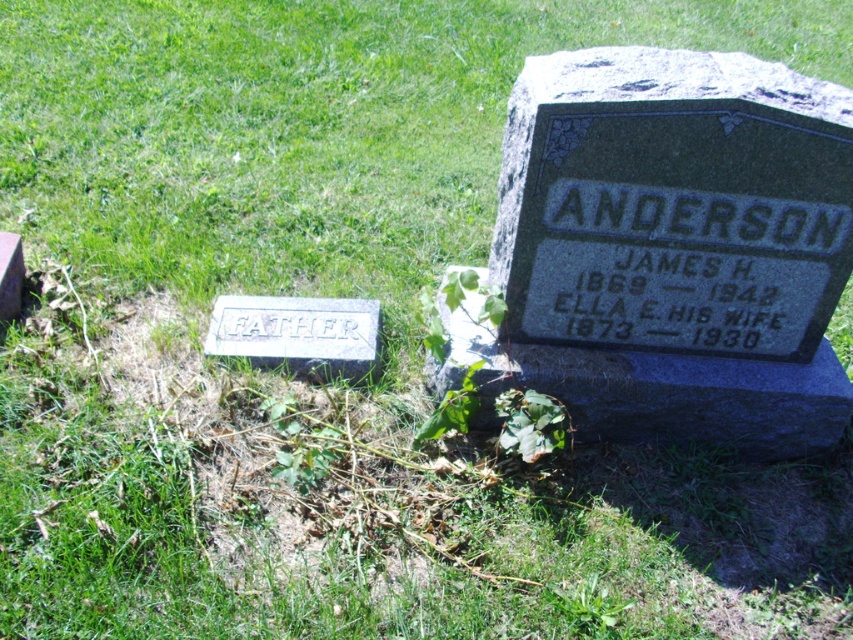
Question: Is granite gravestone at center to the left of green leafy weed at center from the viewer's perspective?

Choices:
 (A) yes
 (B) no

Answer: (B)

Question: Which point is closer to the camera taking this photo?

Choices:
 (A) (213, 355)
 (B) (524, 404)

Answer: (B)

Question: Which object is the farthest from the white stone at lower left?

Choices:
 (A) green leafy weed at center
 (B) green leafy plant at center

Answer: (A)

Question: Which object is farther from the camera taking this photo?

Choices:
 (A) granite gravestone at center
 (B) white stone at lower left

Answer: (B)

Question: Can you confirm if granite gravestone at center is positioned to the right of green leafy plant at center?

Choices:
 (A) no
 (B) yes

Answer: (B)

Question: Is white stone at lower left to the left of green leafy weed at center from the viewer's perspective?

Choices:
 (A) no
 (B) yes

Answer: (B)